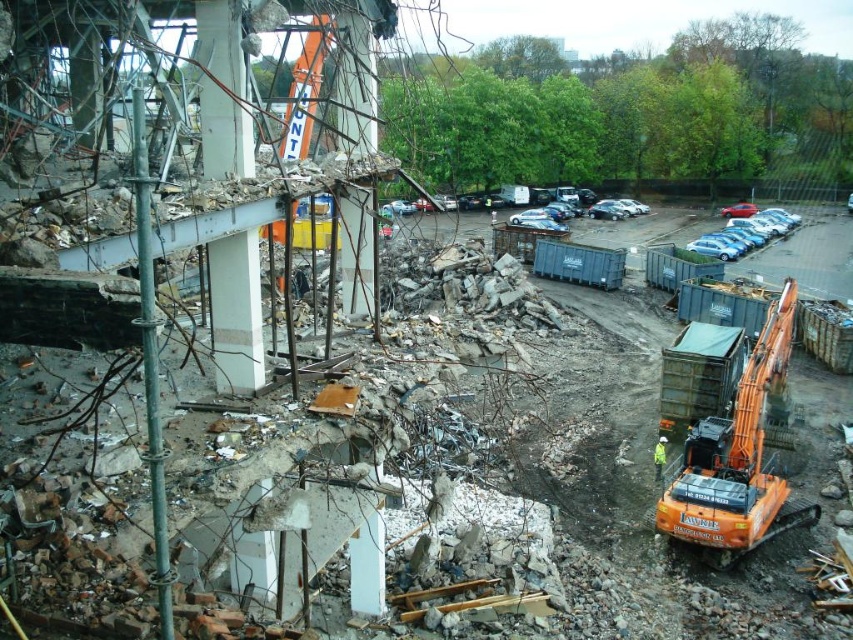
You are a delivery driver who needs to park your truck in the construction site. The truck requires a parking space of 50 meters. The truck is currently at the blue metallic car at right. Can you drive straight to the concrete at center to find a suitable parking space?

The distance between the blue metallic car at right and the concrete at center is 50.15 meters, which is slightly longer than the required 50 meters. Therefore, the truck can drive straight to the concrete at center and find a suitable parking space.

You are standing at the center of the construction site. You need to move a heavy object from the debris pile to the orange metallic excavator at lower right. Which direction should you walk to reach the excavator?

The orange metallic excavator at lower right is located at point [740,458], so you should walk towards the lower right direction to reach it.